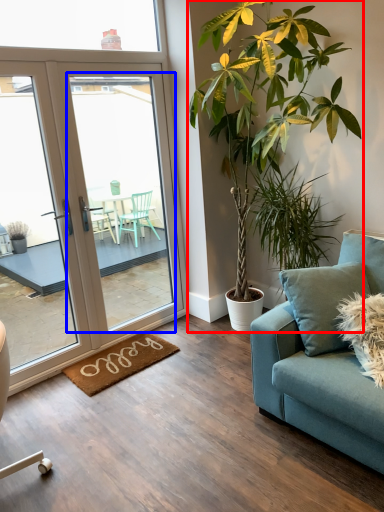
Question: Which point is closer to the camera, houseplant (highlighted by a red box) or screen door (highlighted by a blue box)?

Choices:
 (A) houseplant
 (B) screen door

Answer: (A)